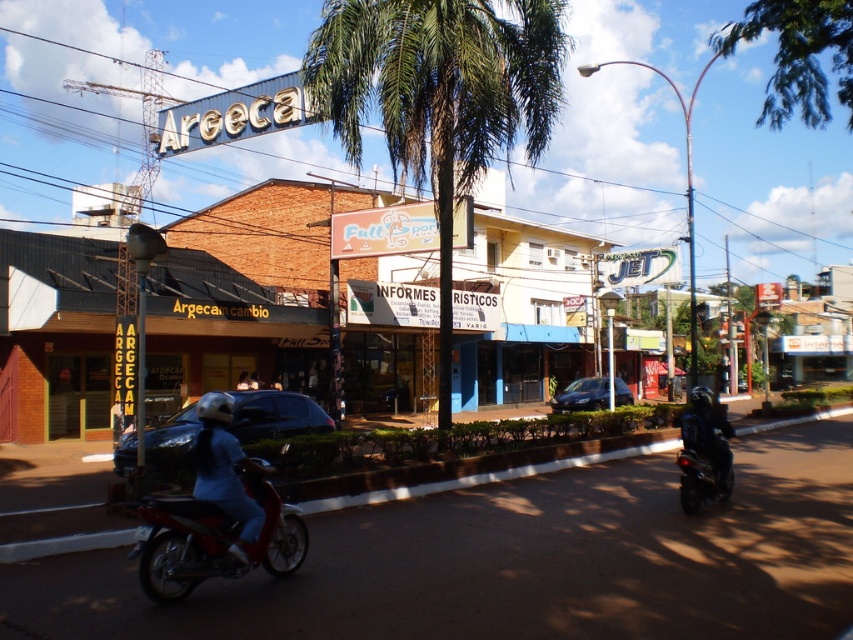
Question: Estimate the real-world distances between objects in this image. Which object is closer to the shiny black motorcycle at lower right?

Choices:
 (A) shiny red motorbike at center
 (B) dark blue leather jacket at center
 (C) green leafy palm tree at center
 (D) brown brick building at center

Answer: (B)

Question: Estimate the real-world distances between objects in this image. Which object is farther from the shiny black motorcycle at lower right?

Choices:
 (A) dark blue leather jacket at center
 (B) shiny red motorbike at center
 (C) blue denim pants at center
 (D) brown brick building at center

Answer: (D)

Question: Is the position of brown brick building at center less distant than that of shiny black motorcycle at lower right?

Choices:
 (A) no
 (B) yes

Answer: (B)

Question: Does blue denim pants at center lie in front of shiny black motorcycle at lower right?

Choices:
 (A) yes
 (B) no

Answer: (A)

Question: Is green leafy palm tree at center positioned in front of blue denim pants at center?

Choices:
 (A) yes
 (B) no

Answer: (B)

Question: Which point is farther to the camera?

Choices:
 (A) shiny red motorbike at center
 (B) dark blue leather jacket at center

Answer: (B)